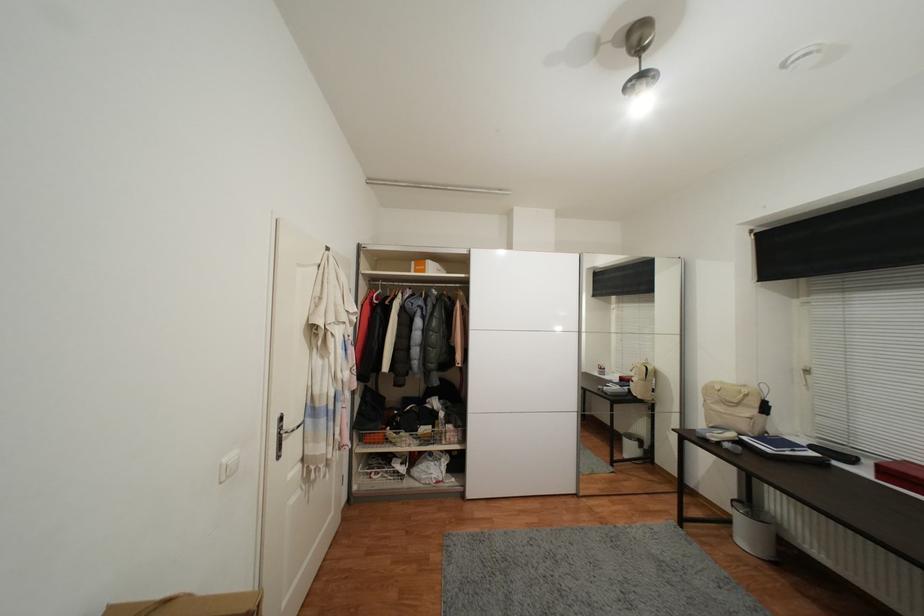
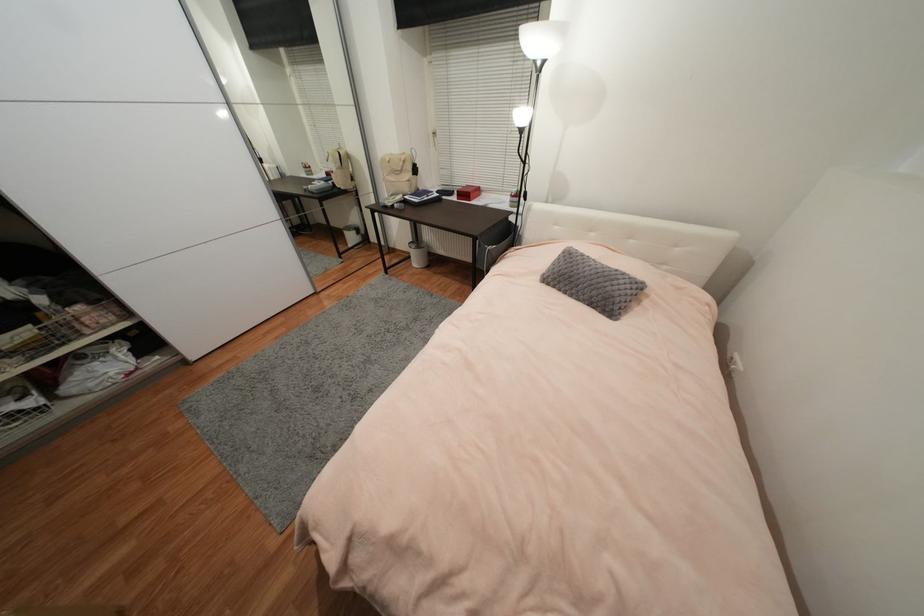
The point at (405,462) is marked in the first image. Where is the corresponding point in the second image?

(14, 400)